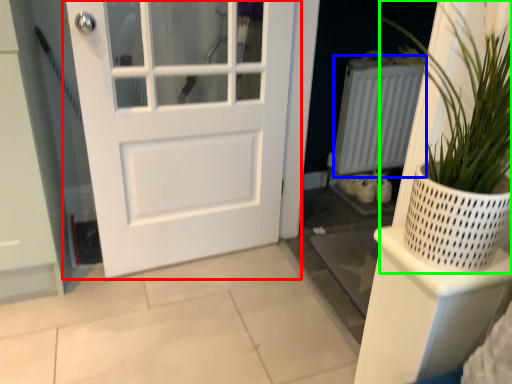
Question: Which object is positioned closest to door (highlighted by a red box)? Select from radiator (highlighted by a blue box) and houseplant (highlighted by a green box).

Choices:
 (A) radiator
 (B) houseplant

Answer: (A)